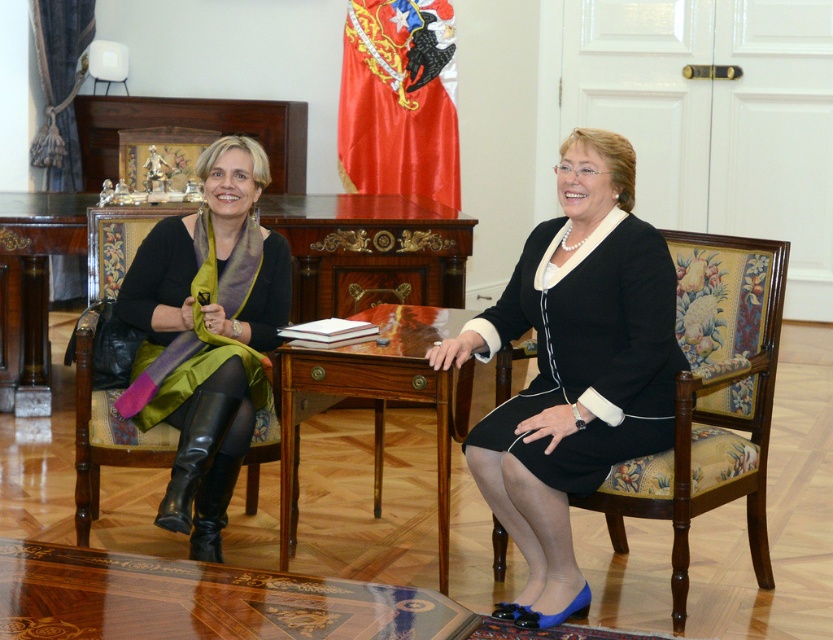
What do you see at coordinates (574, 368) in the screenshot? The image size is (833, 640). I see `black satin dress at center` at bounding box center [574, 368].

Does black satin dress at center have a larger size compared to velvet green chair at left?

Indeed, black satin dress at center has a larger size compared to velvet green chair at left.

Find the location of a particular element. This screenshot has height=640, width=833. black satin dress at center is located at coordinates (574, 368).

Image resolution: width=833 pixels, height=640 pixels. Find the location of `black satin dress at center`. black satin dress at center is located at coordinates (574, 368).

Who is taller, black satin dress at center or glossy wood table at center?

With more height is black satin dress at center.

Who is higher up, black satin dress at center or glossy wood table at center?

black satin dress at center

Where is `black satin dress at center`? This screenshot has height=640, width=833. black satin dress at center is located at coordinates (574, 368).

Does black matte dress at center have a lesser width compared to marquetry wood table at center?

Yes, black matte dress at center is thinner than marquetry wood table at center.

Does black matte dress at center have a lesser height compared to marquetry wood table at center?

In fact, black matte dress at center may be taller than marquetry wood table at center.

Who is more forward, (557, 285) or (333, 621)?

Positioned in front is point (333, 621).

Locate an element on the screen. The width and height of the screenshot is (833, 640). black matte dress at center is located at coordinates (587, 349).